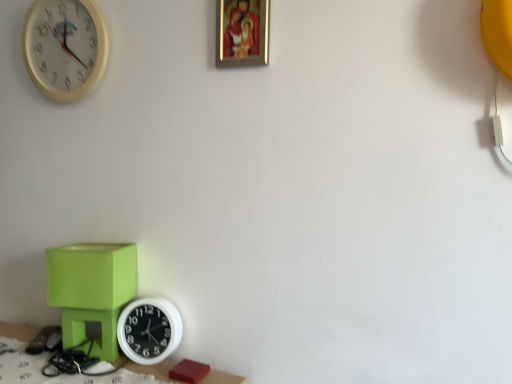
Question: From a real-world perspective, is matte green cube at lower left positioned above or below white plastic wall clock at lower left, the 1th wall clock in the right-to-left sequence?

Choices:
 (A) below
 (B) above

Answer: (B)

Question: Is matte green cube at lower left spatially inside white plastic wall clock at lower left, the second wall clock when ordered from top to bottom, or outside of it?

Choices:
 (A) inside
 (B) outside

Answer: (B)

Question: Estimate the real-world distances between objects in this image. Which object is farther from the white plastic wall clock at upper left, marked as the second wall clock in a bottom-to-top arrangement?

Choices:
 (A) white plastic wall clock at lower left, the 1th wall clock in the right-to-left sequence
 (B) matte green table at lower left
 (C) gold-framed picture at upper center
 (D) matte green cube at lower left

Answer: (B)

Question: Estimate the real-world distances between objects in this image. Which object is closer to the matte green cube at lower left?

Choices:
 (A) gold-framed picture at upper center
 (B) white plastic wall clock at upper left, which is the second wall clock in right-to-left order
 (C) white plastic wall clock at lower left, the second wall clock when ordered from top to bottom
 (D) matte green table at lower left

Answer: (C)